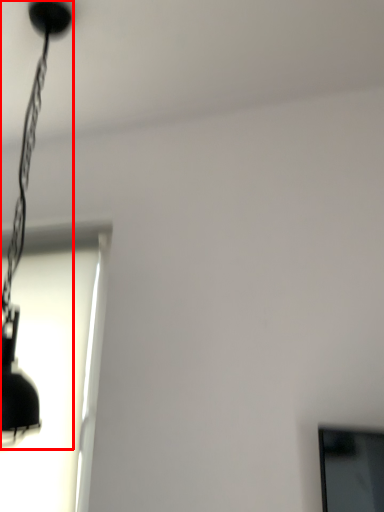
Question: From the image, what is the correct spatial relationship of lamp (annotated by the red box) in relation to window?

Choices:
 (A) right
 (B) left

Answer: (A)